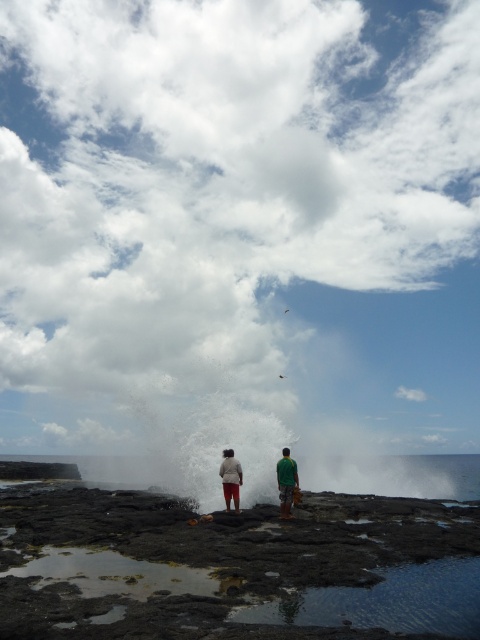
Is green matte shirt at center to the right of matte white pants at center from the viewer's perspective?

Yes, green matte shirt at center is to the right of matte white pants at center.

Who is more forward, (283, 499) or (223, 468)?

Point (283, 499)

Is point (288, 497) positioned before point (235, 508)?

Yes, it is.

Locate an element on the screen. This screenshot has width=480, height=640. green matte shirt at center is located at coordinates (286, 481).

Does lava rock at center appear over green matte shirt at center?

No, lava rock at center is not above green matte shirt at center.

Between lava rock at center and green matte shirt at center, which one appears on the left side from the viewer's perspective?

green matte shirt at center

What do you see at coordinates (240, 563) in the screenshot?
I see `lava rock at center` at bounding box center [240, 563].

This screenshot has height=640, width=480. In order to click on lava rock at center in this screenshot , I will do `click(240, 563)`.

Does matte green shirt at center appear on the right side of green matte shirt at center?

Incorrect, matte green shirt at center is not on the right side of green matte shirt at center.

Which is in front, point (239, 465) or point (287, 448)?

Positioned in front is point (239, 465).

Find the location of a particular element. The width and height of the screenshot is (480, 640). matte green shirt at center is located at coordinates (286, 483).